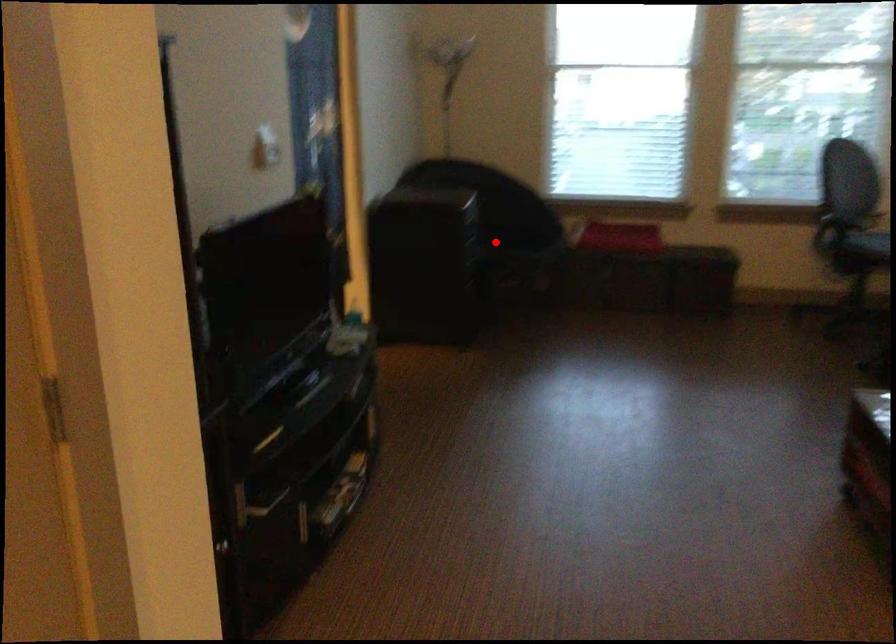
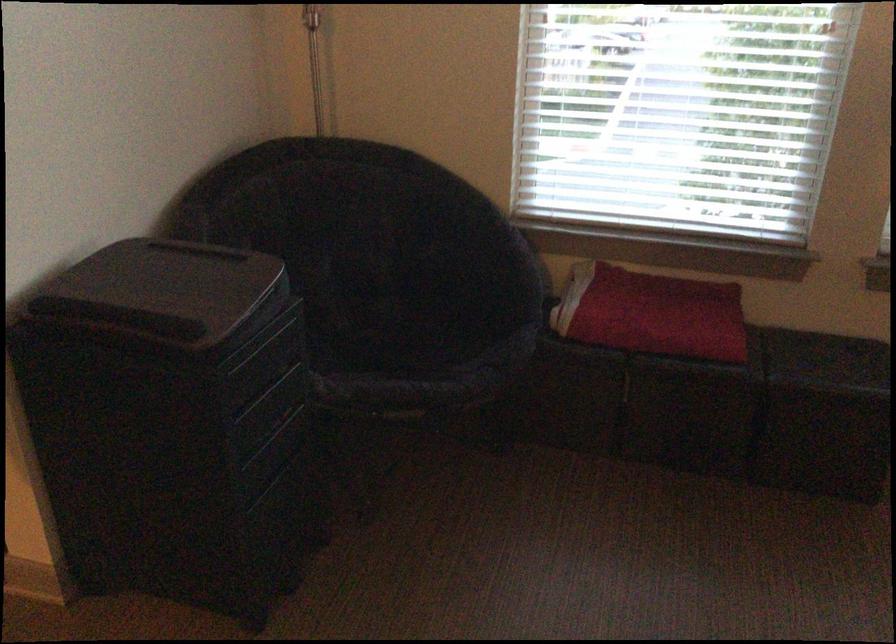
Find the pixel in the second image that matches the highlighted location in the first image.

(393, 339)